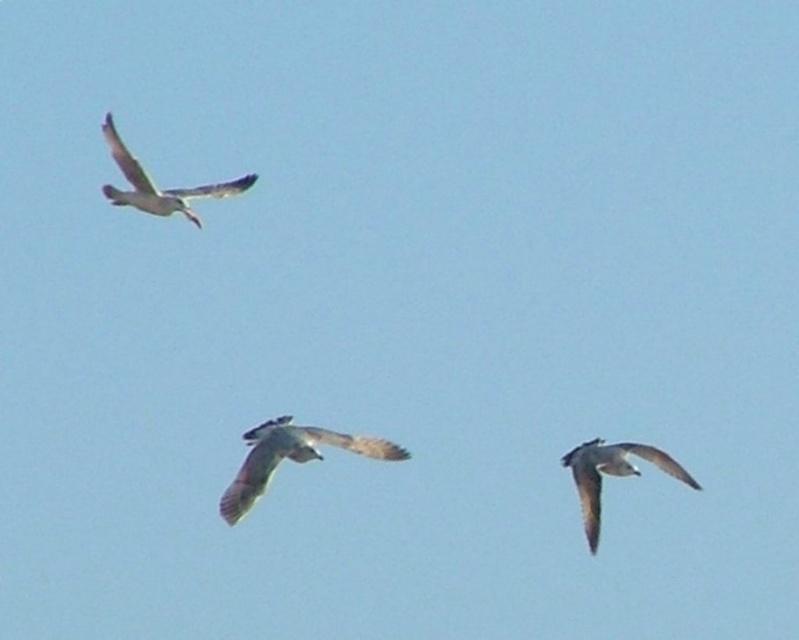
Question: Is gray feathered bird at lower right positioned before speckled feathered bird at upper left?

Choices:
 (A) no
 (B) yes

Answer: (B)

Question: Is gray feathered bird at lower right below speckled feathered bird at upper left?

Choices:
 (A) yes
 (B) no

Answer: (A)

Question: Considering the real-world distances, which object is closest to the speckled feathered bird at upper left?

Choices:
 (A) gray feathered bird at lower right
 (B) light brown feathered bird at center

Answer: (B)

Question: Estimate the real-world distances between objects in this image. Which object is farther from the speckled feathered bird at upper left?

Choices:
 (A) gray feathered bird at lower right
 (B) light brown feathered bird at center

Answer: (A)

Question: Which is nearer to the speckled feathered bird at upper left?

Choices:
 (A) light brown feathered bird at center
 (B) gray feathered bird at lower right

Answer: (A)

Question: Can you confirm if gray feathered bird at lower right is thinner than speckled feathered bird at upper left?

Choices:
 (A) yes
 (B) no

Answer: (A)